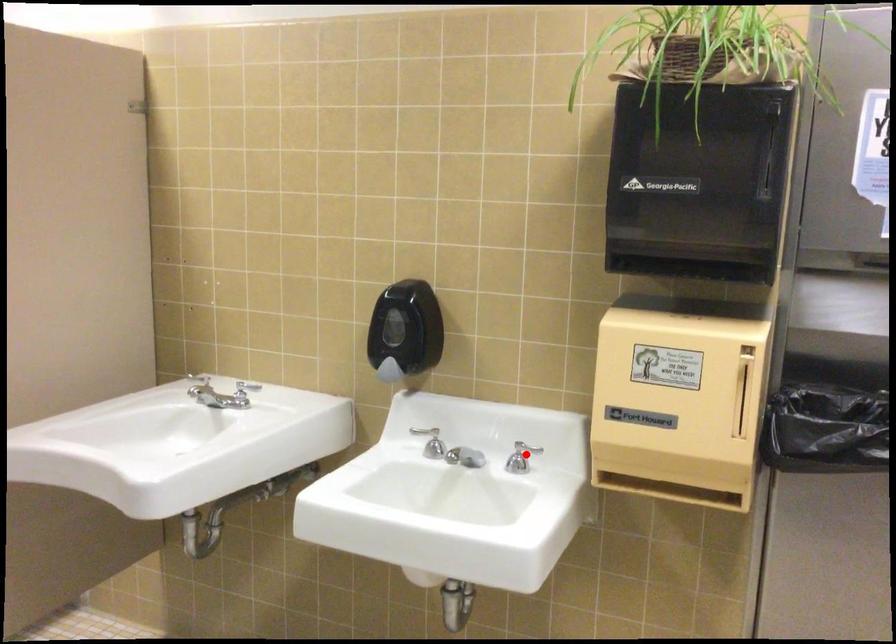
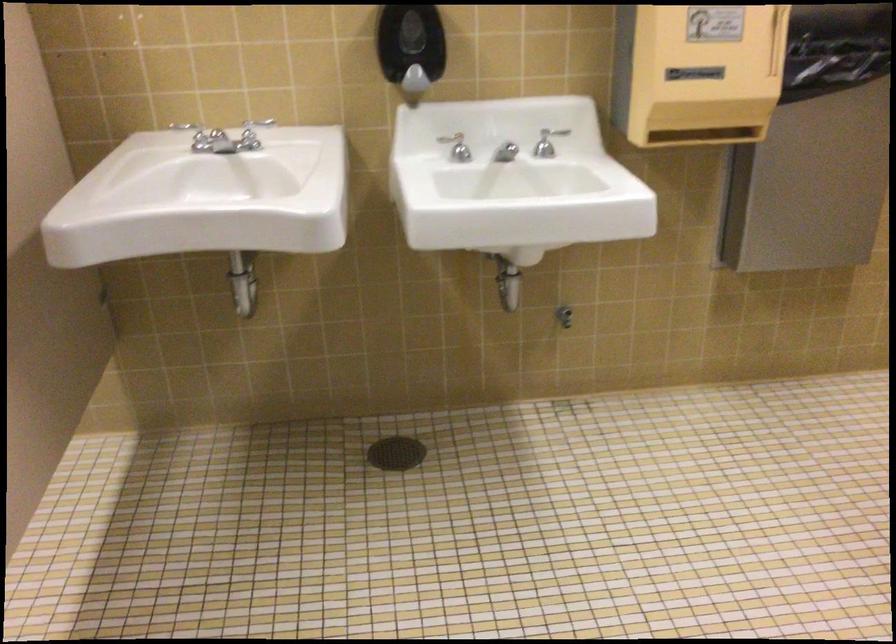
Find the pixel in the second image that matches the highlighted location in the first image.

(547, 142)